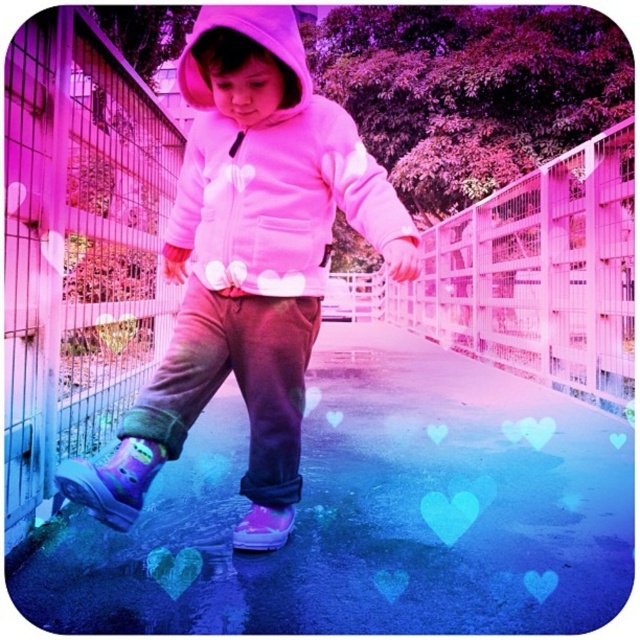
You are a photographer trying to capture the child walking on the pathway. You notice two purple rubber boots in the scene. How far apart are the light purple rubber boot at lower left and the purple rubber boot at lower center?

The light purple rubber boot at lower left is 20.01 inches away from the purple rubber boot at lower center.

You are a photographer trying to capture a shot of the child in the scene. You want to ensure both the pink fleece jacket at center and the light purple rubber boot at lower left are in focus. Given that your camera can only focus on objects within a 25 inch range, will you be able to achieve this?

The pink fleece jacket at center is 26.11 inches away from the light purple rubber boot at lower left. Since the distance exceeds the camera focus range of 25 inches, the photographer cannot have both in focus.

Looking at this image, you are a photographer trying to capture the pink fleece hoodie at center and the transparent plastic puddle at center in the same frame. Based on their heights, which object will appear larger in the photo?

The pink fleece hoodie at center will appear larger in the photo because it is taller than the transparent plastic puddle at center.